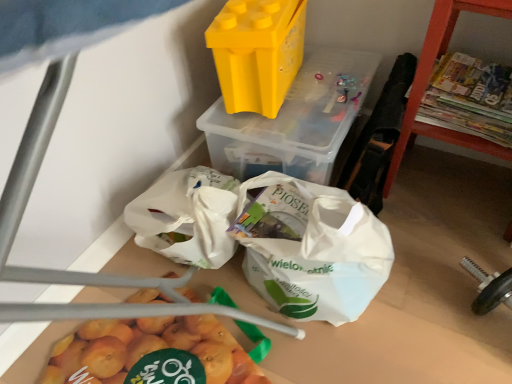
Locate an element on the screen. This screenshot has width=512, height=384. yellow plastic container at upper center, the second yoghurt in the left-to-right sequence is located at coordinates (294, 120).

Where is `yellow plastic container at upper center, acting as the second yoghurt starting from the right`? Image resolution: width=512 pixels, height=384 pixels. yellow plastic container at upper center, acting as the second yoghurt starting from the right is located at coordinates (257, 52).

How many degrees apart are the facing directions of yellow plastic container at upper center, marked as the first yoghurt in a left-to-right arrangement, and orange wood shelf at right?

There is a 103-degree angle between the facing directions of yellow plastic container at upper center, marked as the first yoghurt in a left-to-right arrangement, and orange wood shelf at right.

At what (x,y) coordinates should I click in order to perform the action: click on yoghurt above the orange wood shelf at right (from a real-world perspective). Please return your answer as a coordinate pair (x, y). The height and width of the screenshot is (384, 512). Looking at the image, I should click on (257, 52).

Is yellow plastic container at upper center, acting as the second yoghurt starting from the right, thinner than orange wood shelf at right?

Yes.

Is yellow plastic container at upper center, marked as the first yoghurt in a left-to-right arrangement, inside the boundaries of orange wood shelf at right, or outside?

yellow plastic container at upper center, marked as the first yoghurt in a left-to-right arrangement, is outside orange wood shelf at right.

Is yellow plastic container at upper center, the second yoghurt in the left-to-right sequence, far from yellow plastic container at upper center, acting as the second yoghurt starting from the right?

No, there isn't a large distance between yellow plastic container at upper center, the second yoghurt in the left-to-right sequence, and yellow plastic container at upper center, acting as the second yoghurt starting from the right.

Could you tell me if yellow plastic container at upper center, the second yoghurt in the left-to-right sequence, is turned towards yellow plastic container at upper center, acting as the second yoghurt starting from the right?

No, yellow plastic container at upper center, the second yoghurt in the left-to-right sequence, is not oriented towards yellow plastic container at upper center, acting as the second yoghurt starting from the right.

Is yellow plastic container at upper center, which is the 1th yoghurt from right to left, taller or shorter than yellow plastic container at upper center, marked as the first yoghurt in a left-to-right arrangement?

In the image, yellow plastic container at upper center, which is the 1th yoghurt from right to left, appears to be taller than yellow plastic container at upper center, marked as the first yoghurt in a left-to-right arrangement.

Which is in front, point (250, 126) or point (301, 23)?

The point (250, 126) is in front.

Considering the relative sizes of yellow plastic container at upper center, acting as the second yoghurt starting from the right, and yellow plastic container at upper center, which is the 1th yoghurt from right to left, in the image provided, is yellow plastic container at upper center, acting as the second yoghurt starting from the right, shorter than yellow plastic container at upper center, which is the 1th yoghurt from right to left,?

Yes, yellow plastic container at upper center, acting as the second yoghurt starting from the right, is shorter than yellow plastic container at upper center, which is the 1th yoghurt from right to left.

Which is in front, point (259, 23) or point (222, 132)?

Point (259, 23)

From the image's perspective, between yellow plastic container at upper center, marked as the first yoghurt in a left-to-right arrangement, and yellow plastic container at upper center, the second yoghurt in the left-to-right sequence, which one is located above?

yellow plastic container at upper center, marked as the first yoghurt in a left-to-right arrangement, appears higher in the image.

Is yellow plastic container at upper center, acting as the second yoghurt starting from the right, with yellow plastic container at upper center, the second yoghurt in the left-to-right sequence?

yellow plastic container at upper center, acting as the second yoghurt starting from the right, and yellow plastic container at upper center, the second yoghurt in the left-to-right sequence, are clearly separated.

Considering the sizes of yellow plastic container at upper center, the second yoghurt in the left-to-right sequence, and orange wood shelf at right in the image, is yellow plastic container at upper center, the second yoghurt in the left-to-right sequence, bigger or smaller than orange wood shelf at right?

In the image, yellow plastic container at upper center, the second yoghurt in the left-to-right sequence, appears to be smaller than orange wood shelf at right.

Identify the location of yoghurt located below the orange wood shelf at right (from the image's perspective). (294, 120).

What's the angular difference between yellow plastic container at upper center, the second yoghurt in the left-to-right sequence, and orange wood shelf at right's facing directions?

The facing directions of yellow plastic container at upper center, the second yoghurt in the left-to-right sequence, and orange wood shelf at right are 5.06 degrees apart.

Is the surface of yellow plastic container at upper center, which is the 1th yoghurt from right to left, in direct contact with orange wood shelf at right?

yellow plastic container at upper center, which is the 1th yoghurt from right to left, and orange wood shelf at right are not in contact.

Does orange wood shelf at right come in front of yellow plastic container at upper center, the second yoghurt in the left-to-right sequence?

Yes, the depth of orange wood shelf at right is less than that of yellow plastic container at upper center, the second yoghurt in the left-to-right sequence.

The image size is (512, 384). What are the coordinates of `furniture that is on the right side of yellow plastic container at upper center, the second yoghurt in the left-to-right sequence` in the screenshot? It's located at (430, 77).

Does orange wood shelf at right have a smaller size compared to yellow plastic container at upper center, the second yoghurt in the left-to-right sequence?

No.

Between orange wood shelf at right and yellow plastic container at upper center, the second yoghurt in the left-to-right sequence, which one appears on the left side from the viewer's perspective?

yellow plastic container at upper center, the second yoghurt in the left-to-right sequence, is more to the left.

Is point (411, 103) positioned before point (242, 111)?

Yes, point (411, 103) is in front of point (242, 111).

Starting from the orange wood shelf at right, which yoghurt is the 1st one behind? Please provide its 2D coordinates.

[(257, 52)]

Looking at the image, does orange wood shelf at right seem bigger or smaller compared to yellow plastic container at upper center, marked as the first yoghurt in a left-to-right arrangement?

Considering their sizes, orange wood shelf at right takes up more space than yellow plastic container at upper center, marked as the first yoghurt in a left-to-right arrangement.

From a real-world perspective, is orange wood shelf at right on yellow plastic container at upper center, marked as the first yoghurt in a left-to-right arrangement?

No, from a real-world perspective, orange wood shelf at right is not over yellow plastic container at upper center, marked as the first yoghurt in a left-to-right arrangement

Identify the location of furniture below the yellow plastic container at upper center, marked as the first yoghurt in a left-to-right arrangement (from the image's perspective). The width and height of the screenshot is (512, 384). (430, 77).

The width and height of the screenshot is (512, 384). Identify the location of yoghurt located above the yellow plastic container at upper center, which is the 1th yoghurt from right to left (from a real-world perspective). (257, 52).

Estimate the real-world distances between objects in this image. Which object is further from yellow plastic container at upper center, marked as the first yoghurt in a left-to-right arrangement, orange wood shelf at right or yellow plastic container at upper center, which is the 1th yoghurt from right to left?

Among the two, orange wood shelf at right is located further to yellow plastic container at upper center, marked as the first yoghurt in a left-to-right arrangement.

From the picture: Which object lies nearer to the anchor point yellow plastic container at upper center, which is the 1th yoghurt from right to left, yellow plastic container at upper center, marked as the first yoghurt in a left-to-right arrangement, or orange wood shelf at right?

The object closer to yellow plastic container at upper center, which is the 1th yoghurt from right to left, is yellow plastic container at upper center, marked as the first yoghurt in a left-to-right arrangement.

Estimate the real-world distances between objects in this image. Which object is further from orange wood shelf at right, yellow plastic container at upper center, marked as the first yoghurt in a left-to-right arrangement, or yellow plastic container at upper center, the second yoghurt in the left-to-right sequence?

Among the two, yellow plastic container at upper center, marked as the first yoghurt in a left-to-right arrangement, is located further to orange wood shelf at right.

Estimate the real-world distances between objects in this image. Which object is closer to orange wood shelf at right, yellow plastic container at upper center, the second yoghurt in the left-to-right sequence, or yellow plastic container at upper center, acting as the second yoghurt starting from the right?

The object closer to orange wood shelf at right is yellow plastic container at upper center, the second yoghurt in the left-to-right sequence.

Looking at the image, which one is located closer to yellow plastic container at upper center, acting as the second yoghurt starting from the right, yellow plastic container at upper center, the second yoghurt in the left-to-right sequence, or orange wood shelf at right?

Among the two, yellow plastic container at upper center, the second yoghurt in the left-to-right sequence, is located nearer to yellow plastic container at upper center, acting as the second yoghurt starting from the right.

Which object lies nearer to the anchor point yellow plastic container at upper center, the second yoghurt in the left-to-right sequence, orange wood shelf at right or yellow plastic container at upper center, acting as the second yoghurt starting from the right?

yellow plastic container at upper center, acting as the second yoghurt starting from the right, is positioned closer to the anchor yellow plastic container at upper center, the second yoghurt in the left-to-right sequence.

The width and height of the screenshot is (512, 384). I want to click on yoghurt between yellow plastic container at upper center, acting as the second yoghurt starting from the right, and orange wood shelf at right from left to right, so click(294, 120).